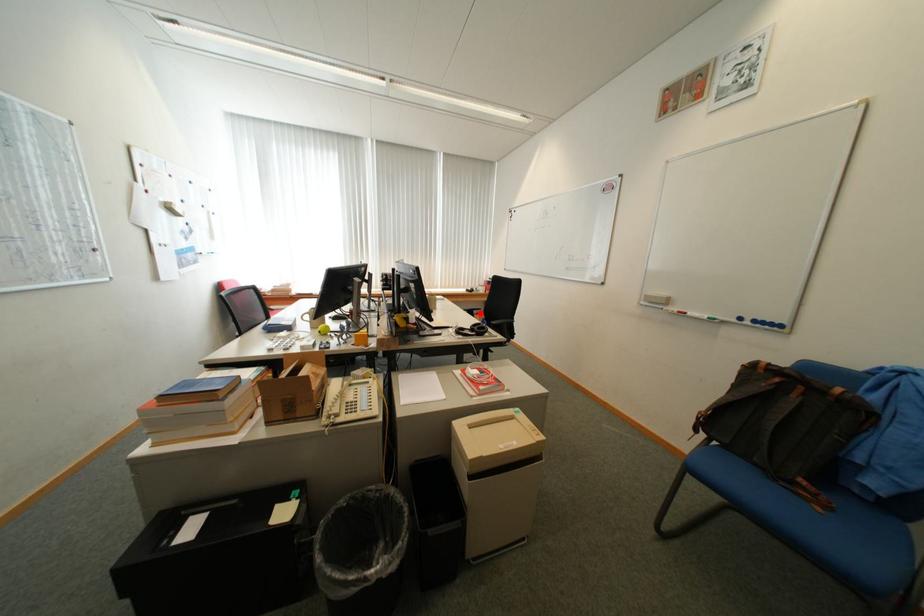
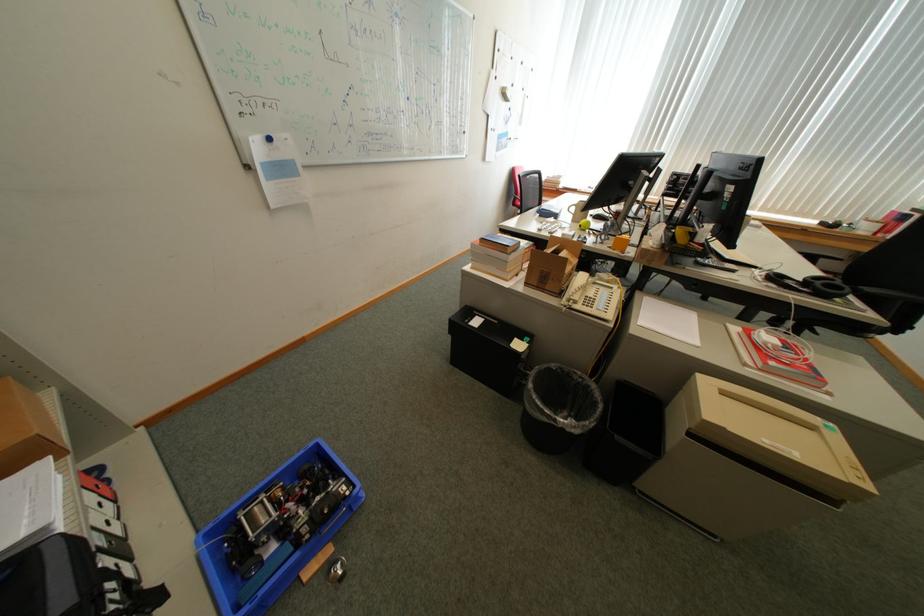
Find the pixel in the second image that matches the highlighted location in the first image.

(821, 260)